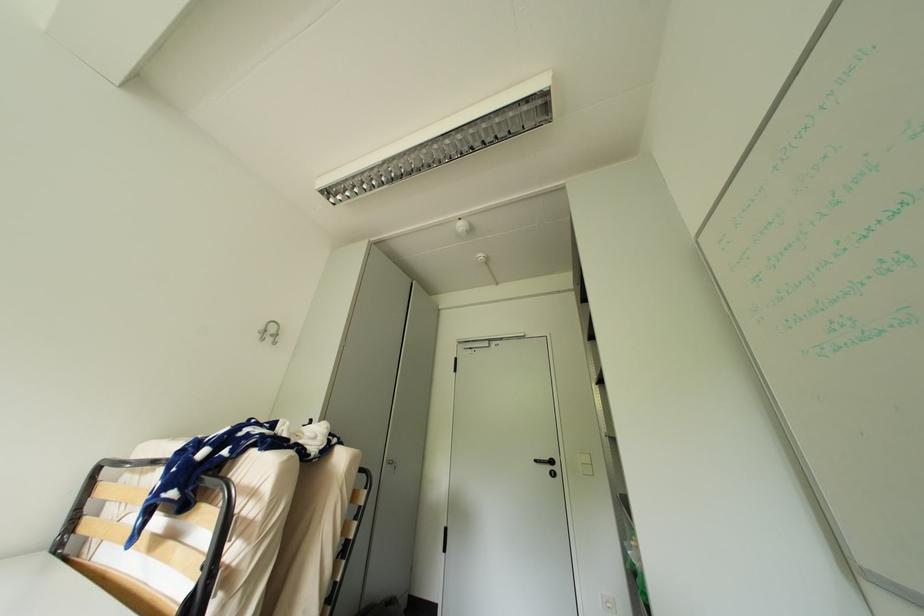
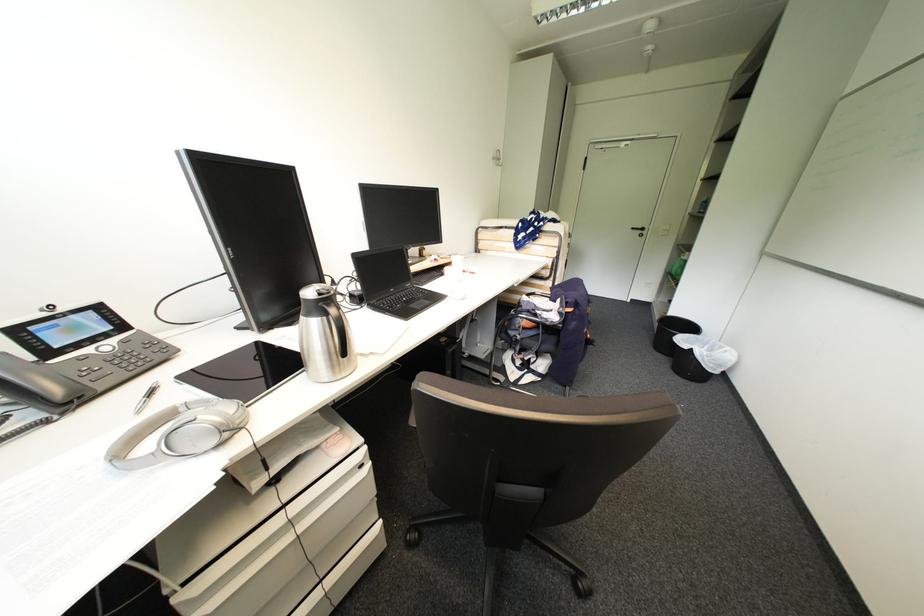
Locate, in the second image, the point that corresponds to (x=556, y=468) in the first image.

(648, 233)